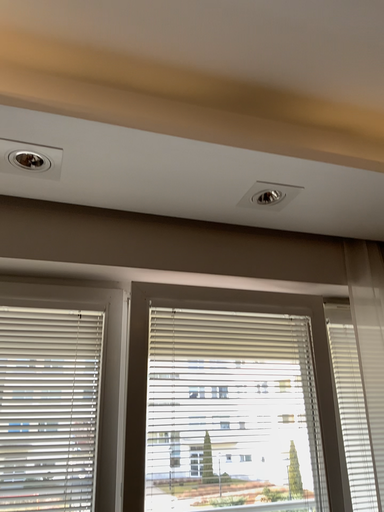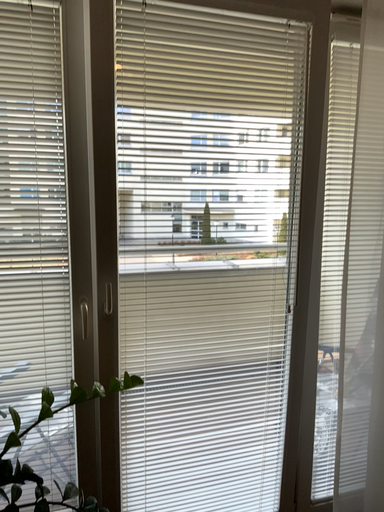
Question: Which way did the camera rotate in the video?

Choices:
 (A) rotated downward
 (B) rotated upward

Answer: (A)